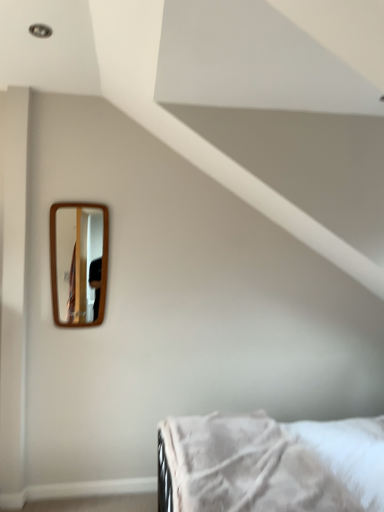
What do you see at coordinates (78, 262) in the screenshot? I see `wooden-framed mirror at upper left` at bounding box center [78, 262].

Measure the distance between wooden-framed mirror at upper left and camera.

They are 13.30 feet apart.

This screenshot has width=384, height=512. I want to click on wooden-framed mirror at upper left, so click(78, 262).

What do you see at coordinates (270, 464) in the screenshot? I see `white soft fabric bed at lower right` at bounding box center [270, 464].

The height and width of the screenshot is (512, 384). I want to click on white soft fabric bed at lower right, so click(270, 464).

This screenshot has width=384, height=512. Identify the location of wooden-framed mirror at upper left. (78, 262).

Can you confirm if wooden-framed mirror at upper left is positioned to the right of white soft fabric bed at lower right?

No, wooden-framed mirror at upper left is not to the right of white soft fabric bed at lower right.

Who is more distant, wooden-framed mirror at upper left or white soft fabric bed at lower right?

Positioned behind is wooden-framed mirror at upper left.

Which point is more forward, [104,290] or [225,474]?

The point [225,474] is closer to the camera.

From the image's perspective, between wooden-framed mirror at upper left and white soft fabric bed at lower right, who is located below?

From the image's view, white soft fabric bed at lower right is below.

Based on the photo, from a real-world perspective, is wooden-framed mirror at upper left above or below white soft fabric bed at lower right?

wooden-framed mirror at upper left is above white soft fabric bed at lower right.

Between wooden-framed mirror at upper left and white soft fabric bed at lower right, which one has smaller width?

Thinner between the two is wooden-framed mirror at upper left.

Is wooden-framed mirror at upper left shorter than white soft fabric bed at lower right?

No, wooden-framed mirror at upper left is not shorter than white soft fabric bed at lower right.

In terms of size, does wooden-framed mirror at upper left appear bigger or smaller than white soft fabric bed at lower right?

Clearly, wooden-framed mirror at upper left is smaller in size than white soft fabric bed at lower right.

Would you say white soft fabric bed at lower right is part of wooden-framed mirror at upper left's contents?

No.

In the scene shown: Would you say wooden-framed mirror at upper left is a long distance from white soft fabric bed at lower right?

Yes, wooden-framed mirror at upper left is far from white soft fabric bed at lower right.

Is wooden-framed mirror at upper left aimed at white soft fabric bed at lower right?

No, wooden-framed mirror at upper left is not facing towards white soft fabric bed at lower right.

At what (x,y) coordinates should I click in order to perform the action: click on bed in front of the wooden-framed mirror at upper left. Please return your answer as a coordinate pair (x, y). Looking at the image, I should click on (x=270, y=464).

Considering the positions of objects white soft fabric bed at lower right and wooden-framed mirror at upper left in the image provided, who is more to the right, white soft fabric bed at lower right or wooden-framed mirror at upper left?

Positioned to the right is white soft fabric bed at lower right.

Considering the positions of objects white soft fabric bed at lower right and wooden-framed mirror at upper left in the image provided, who is in front, white soft fabric bed at lower right or wooden-framed mirror at upper left?

white soft fabric bed at lower right is closer to the camera.

Is point (205, 462) closer or farther from the camera than point (87, 253)?

Point (205, 462) is closer to the camera than point (87, 253).

From the image's perspective, between white soft fabric bed at lower right and wooden-framed mirror at upper left, which one is located above?

wooden-framed mirror at upper left.

From a real-world perspective, is white soft fabric bed at lower right physically below wooden-framed mirror at upper left?

Yes, from a real-world perspective, white soft fabric bed at lower right is below wooden-framed mirror at upper left.

Can you confirm if white soft fabric bed at lower right is thinner than wooden-framed mirror at upper left?

No.

Which of these two, white soft fabric bed at lower right or wooden-framed mirror at upper left, stands taller?

With more height is wooden-framed mirror at upper left.

In terms of size, does white soft fabric bed at lower right appear bigger or smaller than wooden-framed mirror at upper left?

In the image, white soft fabric bed at lower right appears to be larger than wooden-framed mirror at upper left.

Is wooden-framed mirror at upper left located within white soft fabric bed at lower right?

Definitely not — wooden-framed mirror at upper left is not inside white soft fabric bed at lower right.

Would you consider white soft fabric bed at lower right to be distant from wooden-framed mirror at upper left?

Yes.

Does white soft fabric bed at lower right turn towards wooden-framed mirror at upper left?

No, white soft fabric bed at lower right is not facing towards wooden-framed mirror at upper left.

How different are the orientations of white soft fabric bed at lower right and wooden-framed mirror at upper left in degrees?

white soft fabric bed at lower right and wooden-framed mirror at upper left are facing 90 degrees away from each other.

From the picture: How far apart are white soft fabric bed at lower right and wooden-framed mirror at upper left?

8.63 feet.

Locate an element on the screen. The image size is (384, 512). bed below the wooden-framed mirror at upper left (from the image's perspective) is located at coordinates (270, 464).

Image resolution: width=384 pixels, height=512 pixels. In order to click on mirror that is on the left side of white soft fabric bed at lower right in this screenshot , I will do `click(78, 262)`.

At what (x,y) coordinates should I click in order to perform the action: click on mirror above the white soft fabric bed at lower right (from the image's perspective). Please return your answer as a coordinate pair (x, y). The image size is (384, 512). Looking at the image, I should click on (78, 262).